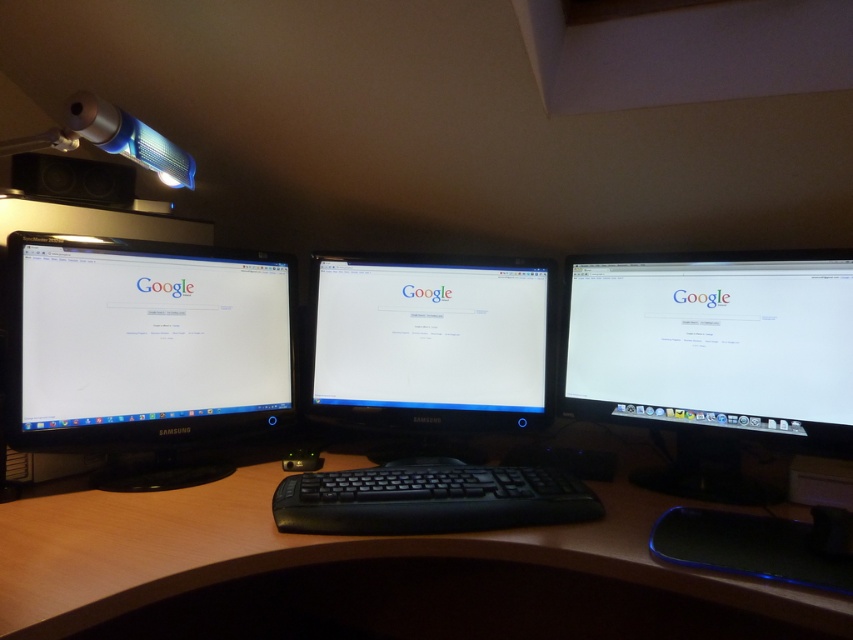
Is point (281, 300) less distant than point (328, 266)?

Yes, it is in front of point (328, 266).

The height and width of the screenshot is (640, 853). Find the location of `black glossy monitor at left`. black glossy monitor at left is located at coordinates (144, 342).

Is point (216, 308) less distant than point (395, 492)?

That is False.

Between point (235, 292) and point (341, 496), which one is positioned in front?

Point (341, 496)

Where is `black glossy monitor at left`? black glossy monitor at left is located at coordinates (144, 342).

In the scene shown: Does brown wood computer desk at center come behind white glossy monitor at right?

No.

This screenshot has height=640, width=853. I want to click on brown wood computer desk at center, so click(375, 570).